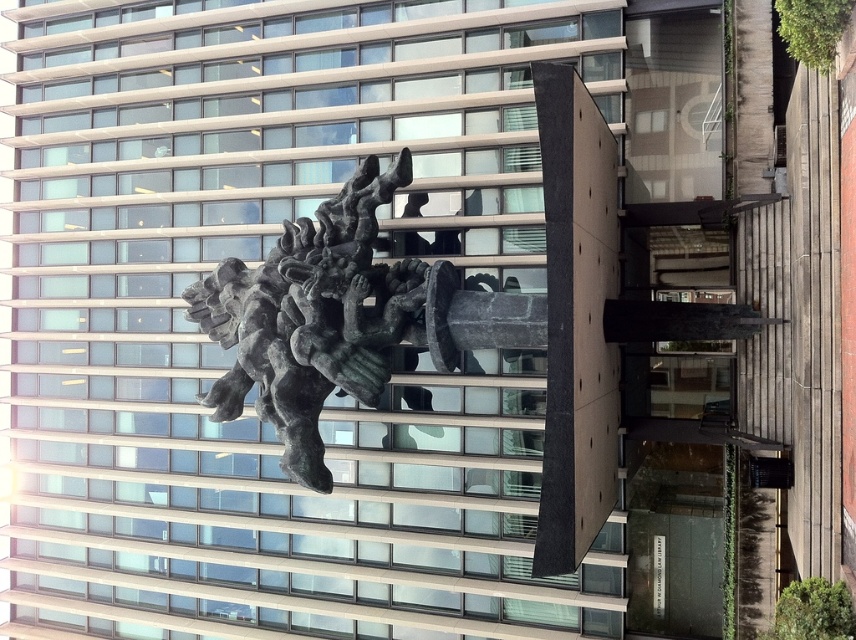
Question: Is clear glass windows at center thinner than bronze statue at center?

Choices:
 (A) no
 (B) yes

Answer: (A)

Question: Is clear glass windows at center to the right of bronze statue at center from the viewer's perspective?

Choices:
 (A) no
 (B) yes

Answer: (A)

Question: Among these points, which one is nearest to the camera?

Choices:
 (A) (256, 160)
 (B) (238, 353)

Answer: (B)

Question: Does clear glass windows at center come behind bronze statue at center?

Choices:
 (A) yes
 (B) no

Answer: (B)

Question: Which object is farther from the camera taking this photo?

Choices:
 (A) clear glass windows at center
 (B) bronze statue at center

Answer: (B)